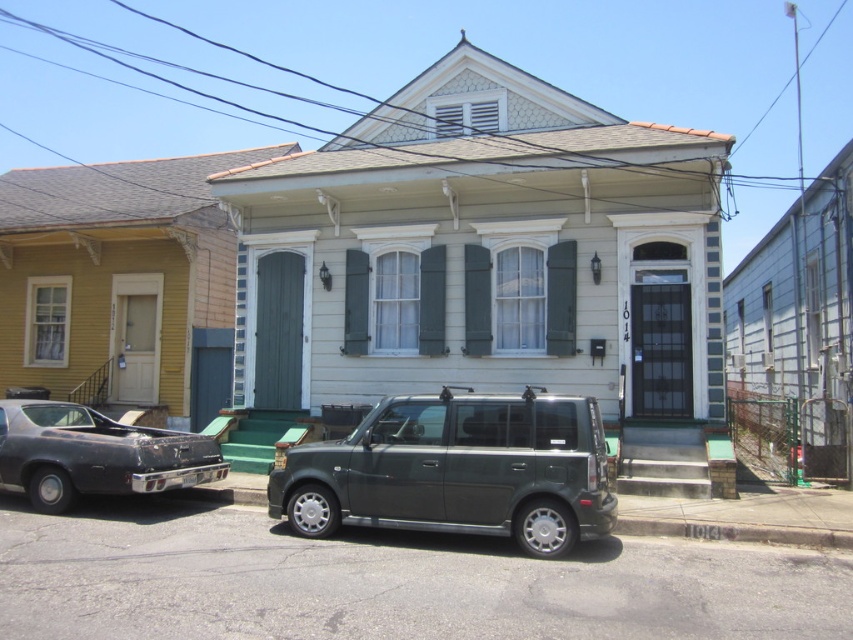
Question: Does black wire at upper center come behind rusty metal car at lower left?

Choices:
 (A) yes
 (B) no

Answer: (A)

Question: Does metallic gray suv at center have a lesser width compared to rusty metal car at lower left?

Choices:
 (A) yes
 (B) no

Answer: (B)

Question: Is metallic gray suv at center positioned before rusty metal car at lower left?

Choices:
 (A) no
 (B) yes

Answer: (B)

Question: Estimate the real-world distances between objects in this image. Which object is farther from the metallic gray suv at center?

Choices:
 (A) black wire at upper center
 (B) rusty metal car at lower left

Answer: (A)

Question: Which of these objects is positioned closest to the metallic gray suv at center?

Choices:
 (A) rusty metal car at lower left
 (B) black wire at upper center

Answer: (A)

Question: Considering the real-world distances, which object is closest to the black wire at upper center?

Choices:
 (A) rusty metal car at lower left
 (B) metallic gray suv at center

Answer: (A)